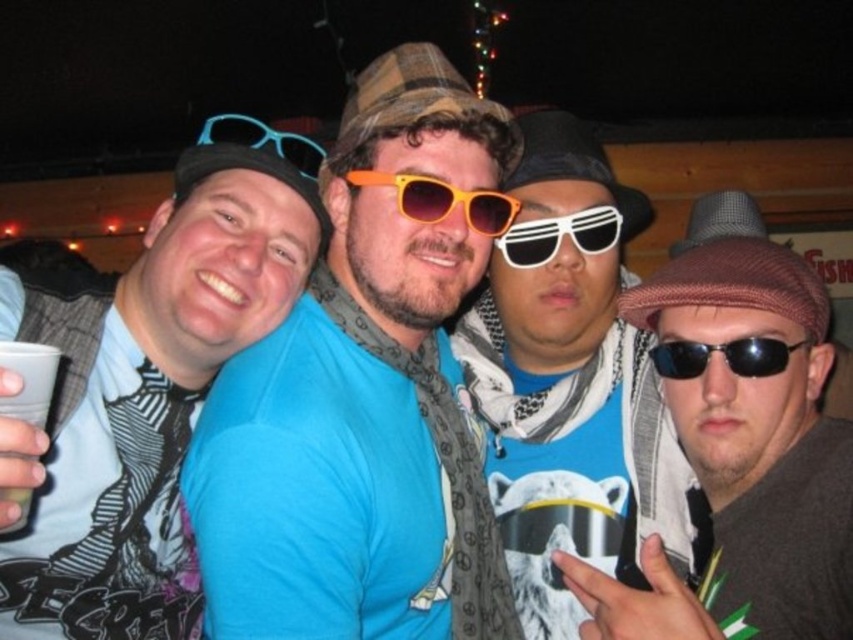
Question: Which of the following is the closest to the observer?

Choices:
 (A) tap(376, 170)
 (B) tap(544, 342)

Answer: (A)

Question: Does orange plastic sunglasses at center have a larger size compared to black reflective sunglasses at right?

Choices:
 (A) no
 (B) yes

Answer: (B)

Question: Does matte blue shirt at center have a smaller size compared to orange plastic sunglasses at center?

Choices:
 (A) yes
 (B) no

Answer: (B)

Question: Is matte blue shirt at center closer to the viewer compared to white plastic sunglasses at center?

Choices:
 (A) yes
 (B) no

Answer: (A)

Question: Which of these objects is positioned farthest from the black reflective sunglasses at right?

Choices:
 (A) matte blue shirt at center
 (B) white printed t-shirt at center

Answer: (A)

Question: Estimate the real-world distances between objects in this image. Which object is closer to the matte blue shirt at center?

Choices:
 (A) white plastic sunglasses at center
 (B) brown woolen cap at right

Answer: (A)